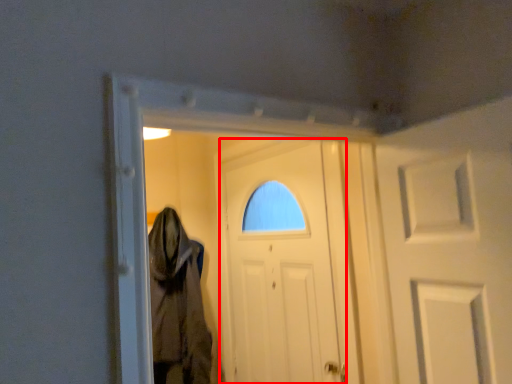
Question: Where is door (annotated by the red box) located in relation to cloak in the image?

Choices:
 (A) right
 (B) left

Answer: (A)